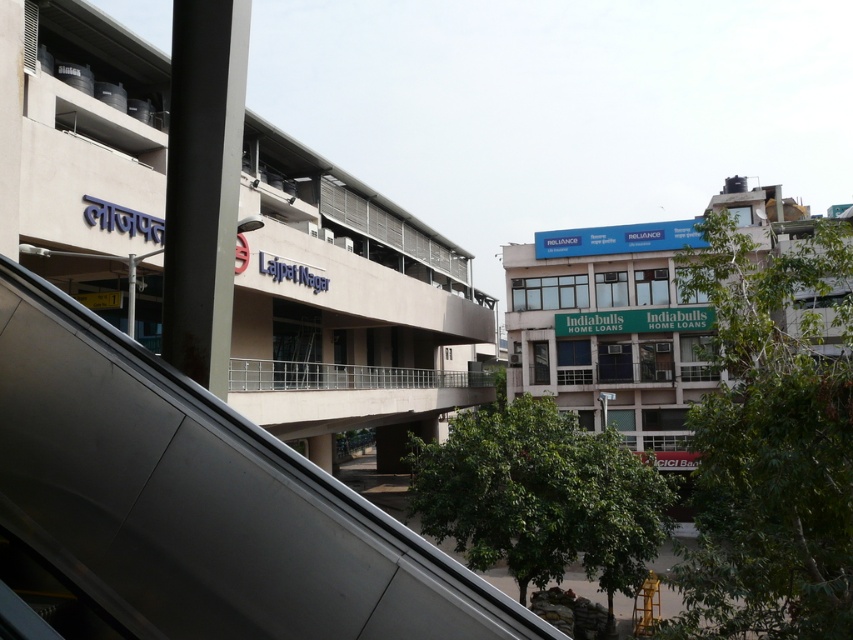
Question: Which of the following is the farthest from the observer?

Choices:
 (A) (291, 365)
 (B) (27, 292)
 (C) (776, 204)
 (D) (456, 307)

Answer: (C)

Question: Is beige concrete mall at center to the left of white glass building at right from the viewer's perspective?

Choices:
 (A) no
 (B) yes

Answer: (B)

Question: Which point is closer to the camera?

Choices:
 (A) silver metallic railing at center
 (B) beige concrete mall at center
 (C) white glass building at right

Answer: (B)

Question: Can you confirm if beige concrete mall at center is bigger than silver metallic railing at center?

Choices:
 (A) no
 (B) yes

Answer: (B)

Question: Can you confirm if sleek silver escalator at left is thinner than white glass building at right?

Choices:
 (A) no
 (B) yes

Answer: (B)

Question: Estimate the real-world distances between objects in this image. Which object is closer to the sleek silver escalator at left?

Choices:
 (A) white glass building at right
 (B) beige concrete mall at center

Answer: (B)